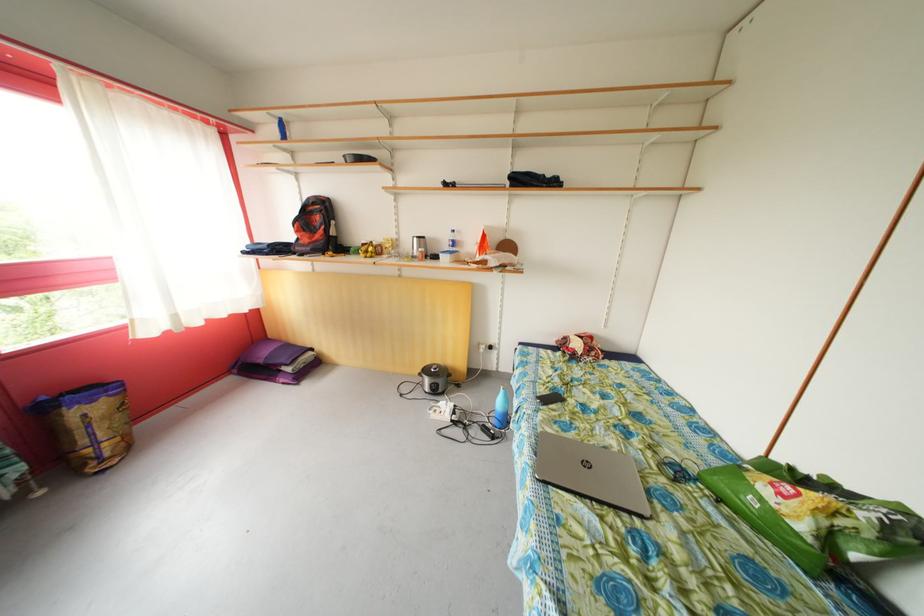
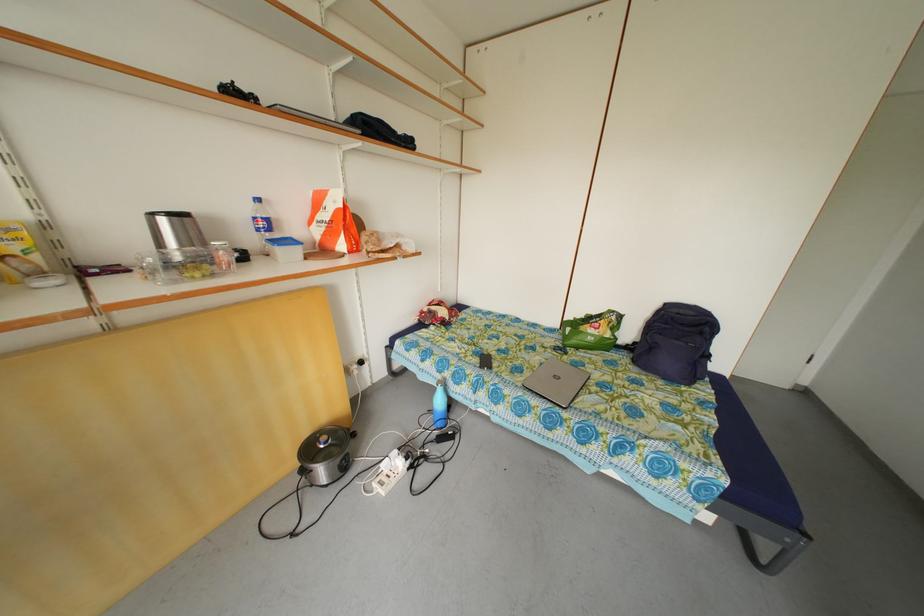
Where in the second image is the point corresponding to [787,500] from the first image?

(602, 334)